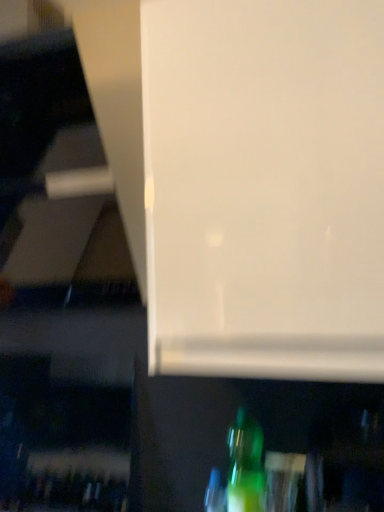
Find the location of a particular element. This screenshot has height=512, width=384. translucent green bottle at lower center, the 2th bottle when ordered from right to left is located at coordinates (215, 493).

What do you see at coordinates (215, 493) in the screenshot? I see `translucent green bottle at lower center, which ranks as the 1th bottle in left-to-right order` at bounding box center [215, 493].

What do you see at coordinates (245, 465) in the screenshot? This screenshot has width=384, height=512. I see `green glass bottle at lower center, the 1th bottle positioned from the right` at bounding box center [245, 465].

The height and width of the screenshot is (512, 384). Find the location of `green glass bottle at lower center, the 1th bottle positioned from the right`. green glass bottle at lower center, the 1th bottle positioned from the right is located at coordinates (245, 465).

At what (x,y) coordinates should I click in order to perform the action: click on translucent green bottle at lower center, which ranks as the 1th bottle in left-to-right order. Please return your answer as a coordinate pair (x, y). The width and height of the screenshot is (384, 512). Looking at the image, I should click on (215, 493).

Considering the positions of objects green glass bottle at lower center, which is counted as the second bottle, starting from the left, and translucent green bottle at lower center, the 2th bottle when ordered from right to left, in the image provided, who is more to the right, green glass bottle at lower center, which is counted as the second bottle, starting from the left, or translucent green bottle at lower center, the 2th bottle when ordered from right to left,?

green glass bottle at lower center, which is counted as the second bottle, starting from the left, is more to the right.

Which is in front, green glass bottle at lower center, the 1th bottle positioned from the right, or translucent green bottle at lower center, which ranks as the 1th bottle in left-to-right order?

Positioned in front is green glass bottle at lower center, the 1th bottle positioned from the right.

Does point (239, 451) lie in front of point (212, 490)?

Yes, point (239, 451) is closer to viewer.

From the image's perspective, is green glass bottle at lower center, the 1th bottle positioned from the right, under translucent green bottle at lower center, which ranks as the 1th bottle in left-to-right order?

No, from the image's perspective, green glass bottle at lower center, the 1th bottle positioned from the right, is not below translucent green bottle at lower center, which ranks as the 1th bottle in left-to-right order.

From a real-world perspective, who is located higher, green glass bottle at lower center, the 1th bottle positioned from the right, or translucent green bottle at lower center, the 2th bottle when ordered from right to left?

green glass bottle at lower center, the 1th bottle positioned from the right, from a real-world perspective.

Considering the sizes of objects green glass bottle at lower center, which is counted as the second bottle, starting from the left, and translucent green bottle at lower center, the 2th bottle when ordered from right to left, in the image provided, who is thinner, green glass bottle at lower center, which is counted as the second bottle, starting from the left, or translucent green bottle at lower center, the 2th bottle when ordered from right to left,?

Thinner between the two is translucent green bottle at lower center, the 2th bottle when ordered from right to left.

Does green glass bottle at lower center, which is counted as the second bottle, starting from the left, have a lesser height compared to translucent green bottle at lower center, the 2th bottle when ordered from right to left?

In fact, green glass bottle at lower center, which is counted as the second bottle, starting from the left, may be taller than translucent green bottle at lower center, the 2th bottle when ordered from right to left.

From the picture: Is green glass bottle at lower center, which is counted as the second bottle, starting from the left, bigger or smaller than translucent green bottle at lower center, the 2th bottle when ordered from right to left?

Clearly, green glass bottle at lower center, which is counted as the second bottle, starting from the left, is larger in size than translucent green bottle at lower center, the 2th bottle when ordered from right to left.

Is green glass bottle at lower center, the 1th bottle positioned from the right, inside the boundaries of translucent green bottle at lower center, which ranks as the 1th bottle in left-to-right order, or outside?

green glass bottle at lower center, the 1th bottle positioned from the right, lies outside translucent green bottle at lower center, which ranks as the 1th bottle in left-to-right order.

Is green glass bottle at lower center, which is counted as the second bottle, starting from the left, positioned far away from translucent green bottle at lower center, which ranks as the 1th bottle in left-to-right order?

green glass bottle at lower center, which is counted as the second bottle, starting from the left, is actually quite close to translucent green bottle at lower center, which ranks as the 1th bottle in left-to-right order.

Is green glass bottle at lower center, the 1th bottle positioned from the right, turned away from translucent green bottle at lower center, the 2th bottle when ordered from right to left?

No.

How many degrees apart are the facing directions of green glass bottle at lower center, which is counted as the second bottle, starting from the left, and translucent green bottle at lower center, which ranks as the 1th bottle in left-to-right order?

0.000864 degrees.

How far apart are green glass bottle at lower center, which is counted as the second bottle, starting from the left, and translucent green bottle at lower center, the 2th bottle when ordered from right to left?

A distance of 3.40 inches exists between green glass bottle at lower center, which is counted as the second bottle, starting from the left, and translucent green bottle at lower center, the 2th bottle when ordered from right to left.

Locate an element on the screen. bottle on the right of the translucent green bottle at lower center, which ranks as the 1th bottle in left-to-right order is located at coordinates (x=245, y=465).

Which is more to the left, translucent green bottle at lower center, which ranks as the 1th bottle in left-to-right order, or green glass bottle at lower center, which is counted as the second bottle, starting from the left?

From the viewer's perspective, translucent green bottle at lower center, which ranks as the 1th bottle in left-to-right order, appears more on the left side.

Is translucent green bottle at lower center, which ranks as the 1th bottle in left-to-right order, further to camera compared to green glass bottle at lower center, the 1th bottle positioned from the right?

Yes.

Is point (214, 509) more distant than point (253, 488)?

Yes, point (214, 509) is farther from viewer.

From the image's perspective, is translucent green bottle at lower center, the 2th bottle when ordered from right to left, above green glass bottle at lower center, which is counted as the second bottle, starting from the left?

No, from the image's perspective, translucent green bottle at lower center, the 2th bottle when ordered from right to left, is not above green glass bottle at lower center, which is counted as the second bottle, starting from the left.

From a real-world perspective, relative to green glass bottle at lower center, which is counted as the second bottle, starting from the left, is translucent green bottle at lower center, the 2th bottle when ordered from right to left, vertically above or below?

In terms of real-world spatial position, translucent green bottle at lower center, the 2th bottle when ordered from right to left, is below green glass bottle at lower center, which is counted as the second bottle, starting from the left.

In the scene shown: Looking at their sizes, would you say translucent green bottle at lower center, the 2th bottle when ordered from right to left, is wider or thinner than green glass bottle at lower center, which is counted as the second bottle, starting from the left?

translucent green bottle at lower center, the 2th bottle when ordered from right to left, is thinner than green glass bottle at lower center, which is counted as the second bottle, starting from the left.

In terms of height, does translucent green bottle at lower center, which ranks as the 1th bottle in left-to-right order, look taller or shorter compared to green glass bottle at lower center, which is counted as the second bottle, starting from the left?

translucent green bottle at lower center, which ranks as the 1th bottle in left-to-right order, is shorter than green glass bottle at lower center, which is counted as the second bottle, starting from the left.

Considering the relative sizes of translucent green bottle at lower center, which ranks as the 1th bottle in left-to-right order, and green glass bottle at lower center, the 1th bottle positioned from the right, in the image provided, is translucent green bottle at lower center, which ranks as the 1th bottle in left-to-right order, smaller than green glass bottle at lower center, the 1th bottle positioned from the right,?

Yes.

Is translucent green bottle at lower center, the 2th bottle when ordered from right to left, spatially inside green glass bottle at lower center, which is counted as the second bottle, starting from the left, or outside of it?

translucent green bottle at lower center, the 2th bottle when ordered from right to left, exists outside the volume of green glass bottle at lower center, which is counted as the second bottle, starting from the left.

Is translucent green bottle at lower center, the 2th bottle when ordered from right to left, placed right next to green glass bottle at lower center, which is counted as the second bottle, starting from the left?

Yes, translucent green bottle at lower center, the 2th bottle when ordered from right to left, and green glass bottle at lower center, which is counted as the second bottle, starting from the left, clearly make contact.

Is translucent green bottle at lower center, the 2th bottle when ordered from right to left, aimed at green glass bottle at lower center, which is counted as the second bottle, starting from the left?

No, translucent green bottle at lower center, the 2th bottle when ordered from right to left, is not oriented towards green glass bottle at lower center, which is counted as the second bottle, starting from the left.

This screenshot has height=512, width=384. I want to click on bottle that appears below the green glass bottle at lower center, which is counted as the second bottle, starting from the left (from a real-world perspective), so click(x=215, y=493).

This screenshot has height=512, width=384. I want to click on bottle that appears in front of the translucent green bottle at lower center, which ranks as the 1th bottle in left-to-right order, so click(x=245, y=465).

The width and height of the screenshot is (384, 512). Identify the location of bottle above the translucent green bottle at lower center, which ranks as the 1th bottle in left-to-right order (from a real-world perspective). (245, 465).